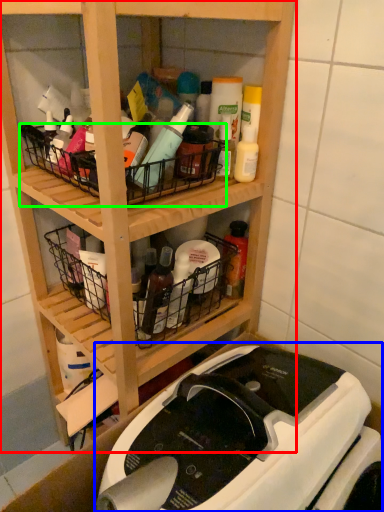
Question: Estimate the real-world distances between objects in this image. Which object is closer to shelf (highlighted by a red box), sewing machine (highlighted by a blue box) or basket (highlighted by a green box)?

Choices:
 (A) sewing machine
 (B) basket

Answer: (B)